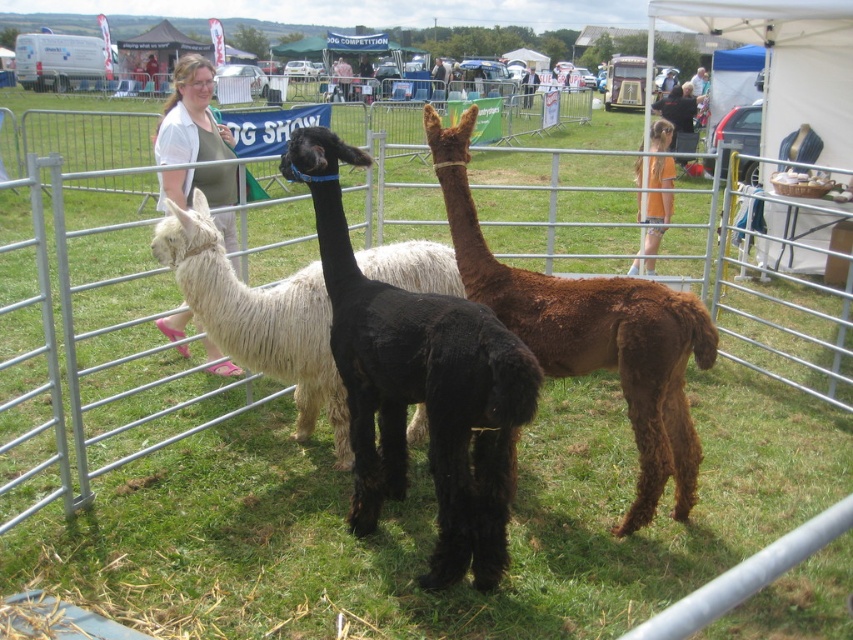
Is black fuzzy alpaca at center thinner than white fluffy alpaca at left?

Yes, black fuzzy alpaca at center is thinner than white fluffy alpaca at left.

Does black fuzzy alpaca at center have a larger size compared to white fluffy alpaca at left?

Yes.

The height and width of the screenshot is (640, 853). Describe the element at coordinates (419, 385) in the screenshot. I see `black fuzzy alpaca at center` at that location.

Find the location of a particular element. black fuzzy alpaca at center is located at coordinates (419, 385).

Can you confirm if black fuzzy alpaca at center is shorter than brown fuzzy alpaca at center?

Indeed, black fuzzy alpaca at center has a lesser height compared to brown fuzzy alpaca at center.

The image size is (853, 640). In order to click on black fuzzy alpaca at center in this screenshot , I will do `click(419, 385)`.

The width and height of the screenshot is (853, 640). Find the location of `black fuzzy alpaca at center`. black fuzzy alpaca at center is located at coordinates [x=419, y=385].

Between brown fuzzy alpaca at center and orange cotton shirt at upper right, which one appears on the left side from the viewer's perspective?

brown fuzzy alpaca at center is more to the left.

Is brown fuzzy alpaca at center smaller than orange cotton shirt at upper right?

No, brown fuzzy alpaca at center is not smaller than orange cotton shirt at upper right.

At what (x,y) coordinates should I click in order to perform the action: click on brown fuzzy alpaca at center. Please return your answer as a coordinate pair (x, y). The width and height of the screenshot is (853, 640). Looking at the image, I should click on (590, 332).